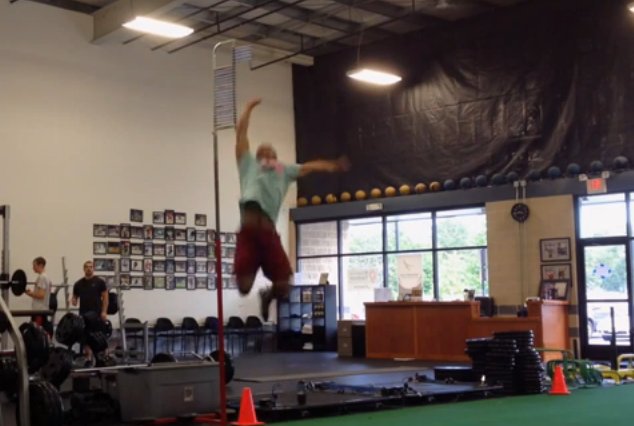
Image resolution: width=634 pixels, height=426 pixels. Find the location of `black floorpads`. black floorpads is located at coordinates (281, 371).